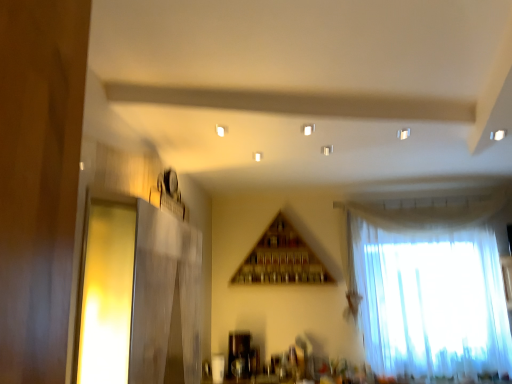
Question: Considering the positions of point (467, 236) and point (130, 266), is point (467, 236) closer or farther from the camera than point (130, 266)?

Choices:
 (A) farther
 (B) closer

Answer: (A)

Question: Considering the positions of white sheer curtain at right and translucent glass window at left in the image, is white sheer curtain at right wider or thinner than translucent glass window at left?

Choices:
 (A) thin
 (B) wide

Answer: (B)

Question: Looking at the image, does white sheer curtain at right seem bigger or smaller compared to translucent glass window at left?

Choices:
 (A) big
 (B) small

Answer: (A)

Question: From the image's perspective, relative to white sheer curtain at right, is translucent glass window at left above or below?

Choices:
 (A) above
 (B) below

Answer: (A)

Question: From a real-world perspective, is translucent glass window at left physically located above or below white sheer curtain at right?

Choices:
 (A) above
 (B) below

Answer: (B)

Question: Is translucent glass window at left wider or thinner than white sheer curtain at right?

Choices:
 (A) wide
 (B) thin

Answer: (B)

Question: Considering the positions of translucent glass window at left and white sheer curtain at right in the image, is translucent glass window at left bigger or smaller than white sheer curtain at right?

Choices:
 (A) small
 (B) big

Answer: (A)